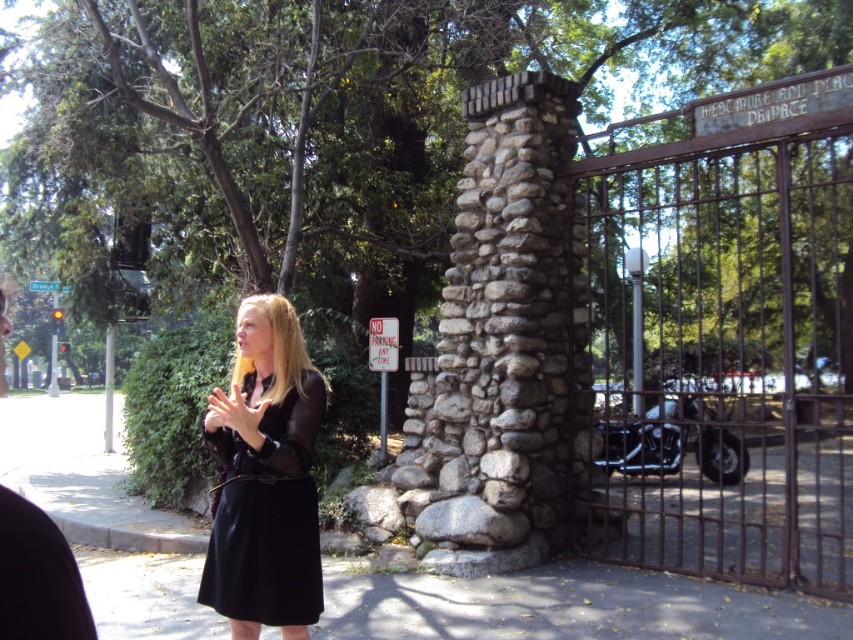
You are a delivery person with a 3.5 feet wide cart. You need to pass through the gate to deliver a package to the motorcycle parked inside. The gate is partially open. Can your cart fit through the gap between the gray concrete pavement at lower center and the smooth skin hands at center?

The distance between the gray concrete pavement at lower center and the smooth skin hands at center is 10.22 feet, which is wider than the cart width of 3.5 feet. Therefore, the cart can fit through the gap.